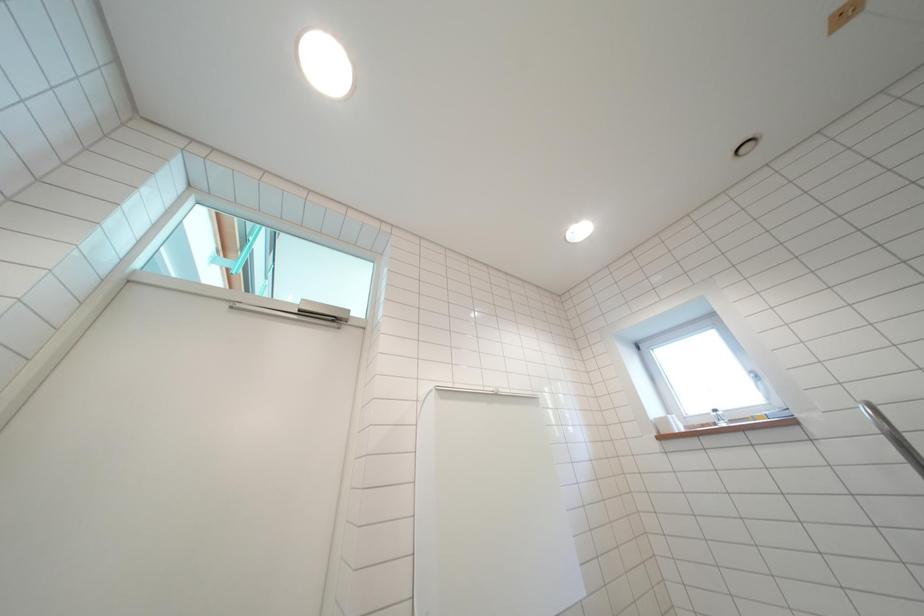
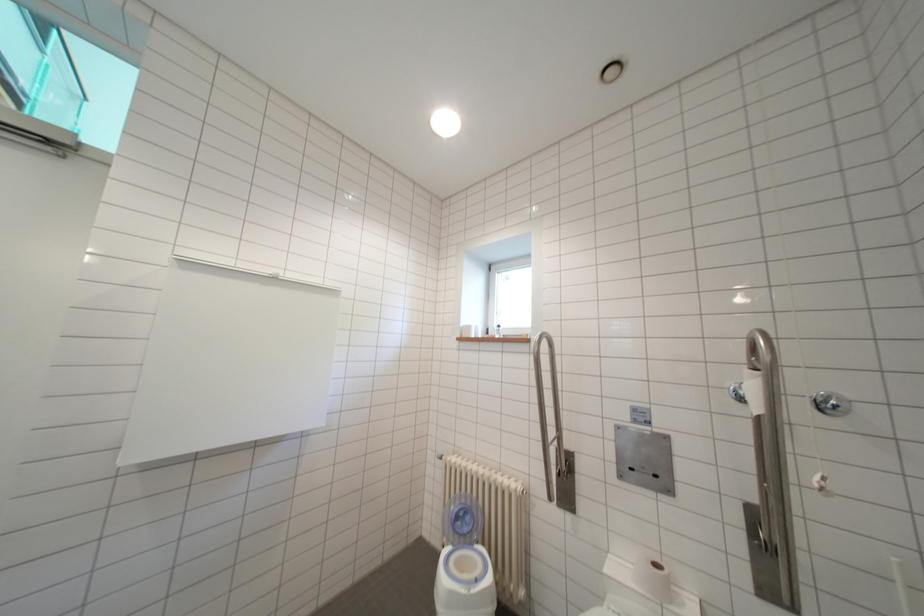
Based on the continuous images, in which direction is the camera rotating?

The rotation direction of the camera is right-down.